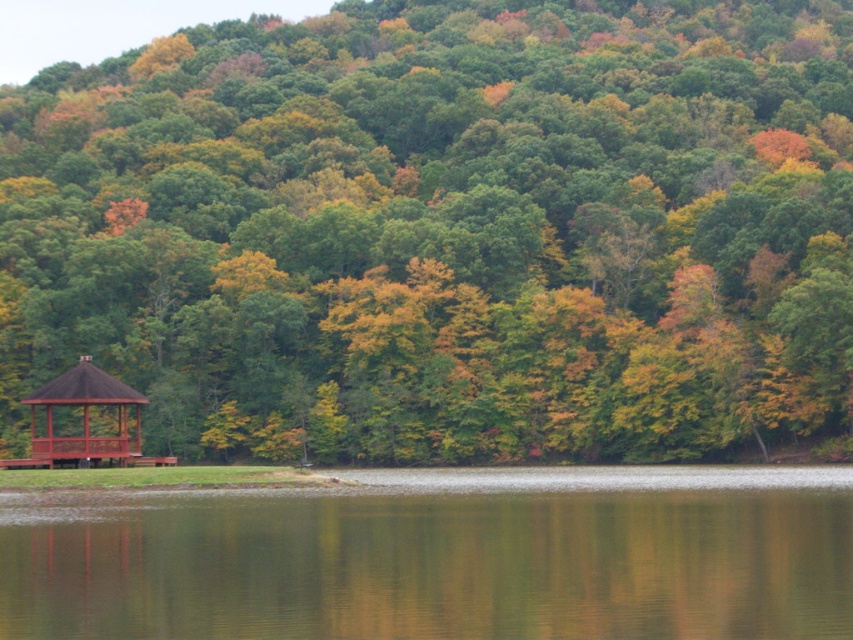
You are standing at the edge of the lake and want to walk to the brown wooden gazebo at left. Which direction should you move to reach it while avoiding the green reflective water at lower center?

The green reflective water at lower center is in front of the brown wooden gazebo at left, so to reach the gazebo without stepping on the water, you should move to the left or right around the water.

You are standing on the grassy area near the edge of the lake and want to reach the green reflective water at lower center without getting your feet wet. Can you walk directly to it from the green matte gazebo at lower left?

The green matte gazebo at lower left is positioned over green reflective water at lower center, so you can walk directly to the green reflective water at lower center from the green matte gazebo at lower left without getting your feet wet because the gazebo is built over the water.

You are planning to set up a picnic blanket between the green matte gazebo at lower left and the green reflective water at lower center. Considering their widths, which object should you place your blanket closer to if you want more space for your picnic?

The green matte gazebo at lower left has a greater width than the green reflective water at lower center. Therefore, placing the picnic blanket closer to the green matte gazebo at lower left will provide more space for the picnic.